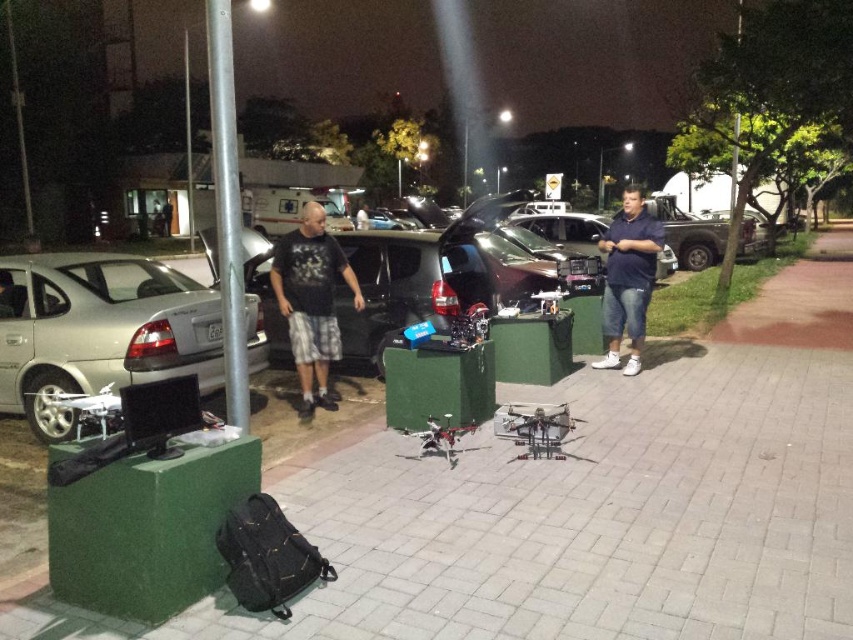
You are a pedestrian trying to cross the parking area at night. You see the brick pavement at center and the silver metallic car at left. Which object is closer to the ground?

The brick pavement at center is located below silver metallic car at left, so it is closer to the ground.

You are standing at the edge of the parking lot and see the silver metallic car at left and the blue cotton shirt at center. Which object is nearer to you?

The silver metallic car at left is closer to the viewer than the blue cotton shirt at center.